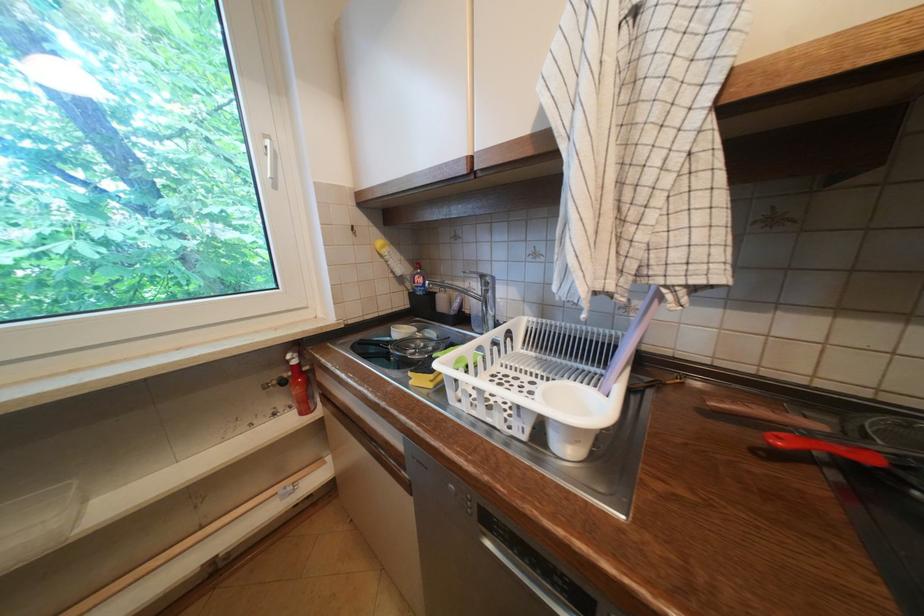
The height and width of the screenshot is (616, 924). Identify the location of dishwasher handle. (568, 589).